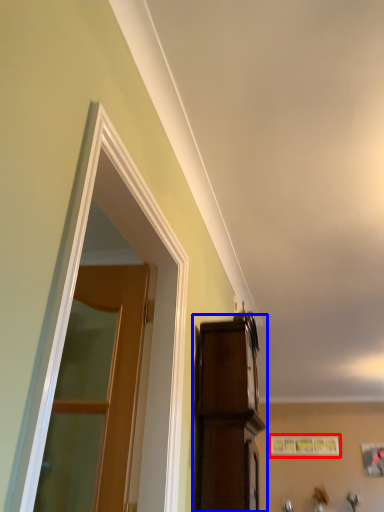
Question: Which object is further to the camera taking this photo, picture frame (highlighted by a red box) or cabinetry (highlighted by a blue box)?

Choices:
 (A) picture frame
 (B) cabinetry

Answer: (A)